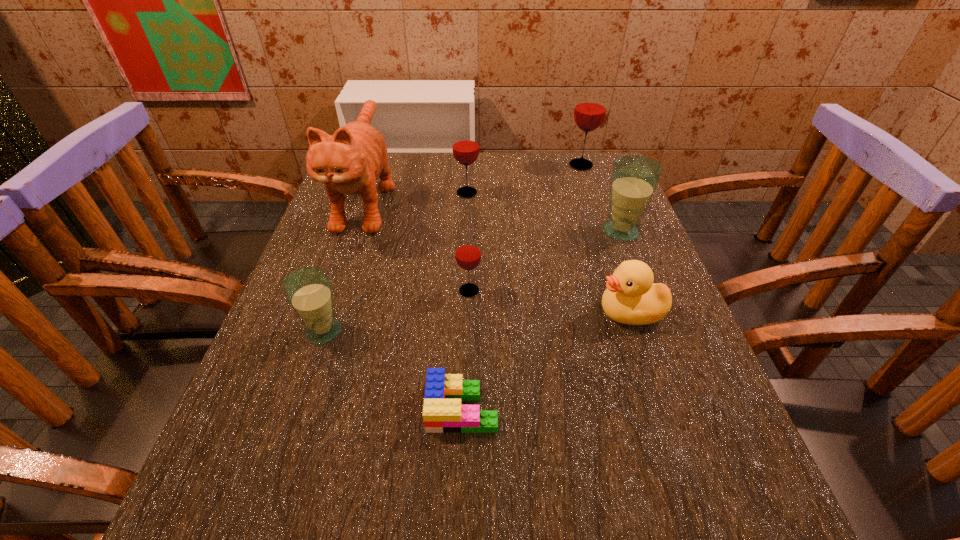
Where is `vacant region located on the back of the nearest glass`? vacant region located on the back of the nearest glass is located at coordinates (x=357, y=231).

This screenshot has width=960, height=540. I want to click on blank space located 0.170m at the beak of the yellow duck, so click(512, 312).

Find the location of a particular element. This screenshot has height=540, width=960. free space located 0.260m at the beak of the yellow duck is located at coordinates (467, 312).

The width and height of the screenshot is (960, 540). What are the coordinates of `vacant space located at the beak of the yellow duck` in the screenshot? It's located at (496, 312).

The width and height of the screenshot is (960, 540). I want to click on blank area located on the back of the shortest object, so click(464, 353).

Identify the location of cat situated at the far edge. The image size is (960, 540). (350, 161).

Locate an element on the screen. This screenshot has height=540, width=960. cat positioned at the left edge is located at coordinates (350, 161).

Identify the location of glass at the left edge. This screenshot has width=960, height=540. (308, 290).

The width and height of the screenshot is (960, 540). Identify the location of duck that is at the right edge. (631, 298).

You are a GUI agent. You are given a task and a screenshot of the screen. Output one action in this format:
    pyautogui.click(x=<x>, y=<y>)
    Task: Click on the object at the far left corner
    Image resolution: width=960 pixels, height=540 pixels.
    Given the screenshot: What is the action you would take?
    pyautogui.click(x=350, y=161)